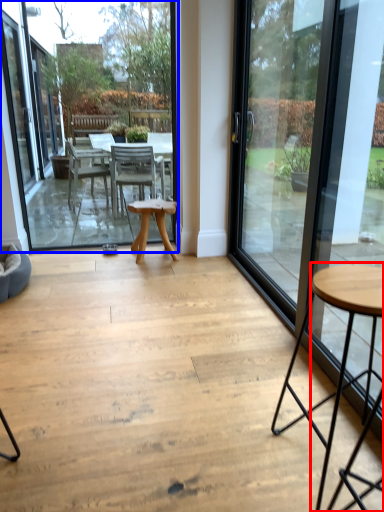
Question: Which object is further to the camera taking this photo, coffee table (highlighted by a red box) or window screen (highlighted by a blue box)?

Choices:
 (A) coffee table
 (B) window screen

Answer: (B)